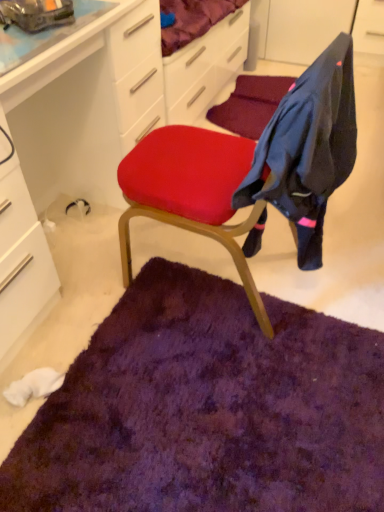
What do you see at coordinates (252, 170) in the screenshot? I see `matte red cushion at center` at bounding box center [252, 170].

Describe the element at coordinates (308, 148) in the screenshot. I see `dark blue fabric at upper right` at that location.

Where is `matte red cushion at center`? The height and width of the screenshot is (512, 384). matte red cushion at center is located at coordinates (252, 170).

From the image's perspective, does dark blue fabric at upper right appear lower than matte red cushion at center?

Yes.

Is dark blue fabric at upper right oriented towards matte red cushion at center?

Yes, dark blue fabric at upper right is turned towards matte red cushion at center.

From a real-world perspective, is dark blue fabric at upper right positioned over matte red cushion at center based on gravity?

Yes, from a real-world perspective, dark blue fabric at upper right is above matte red cushion at center.

Identify the location of clothing on the right of matte red cushion at center. (308, 148).

Would you say purple shaggy rug at center is to the left or to the right of white glossy computer desk at upper left in the picture?

In the image, purple shaggy rug at center appears on the right side of white glossy computer desk at upper left.

Can you confirm if purple shaggy rug at center is smaller than white glossy computer desk at upper left?

Yes.

Is purple shaggy rug at center oriented towards white glossy computer desk at upper left?

No.

In the scene shown: Is white glossy computer desk at upper left located within purple shaggy rug at center?

That's incorrect, white glossy computer desk at upper left is not inside purple shaggy rug at center.

In the image, is purple shaggy rug at center on the left side or the right side of matte red cushion at center?

In the image, purple shaggy rug at center appears on the left side of matte red cushion at center.

In the scene shown: Can you confirm if purple shaggy rug at center is shorter than matte red cushion at center?

Correct, purple shaggy rug at center is not as tall as matte red cushion at center.

Based on the photo, is purple shaggy rug at center not close to matte red cushion at center?

No, there isn't a large distance between purple shaggy rug at center and matte red cushion at center.

Between point (209, 309) and point (243, 162), which one is positioned behind?

The point (209, 309) is more distant.

Is white glossy computer desk at upper left at the left side of matte red cushion at center?

Yes, white glossy computer desk at upper left is to the left of matte red cushion at center.

Could you tell me if white glossy computer desk at upper left is turned towards matte red cushion at center?

Yes, white glossy computer desk at upper left is facing matte red cushion at center.

From a real-world perspective, between white glossy computer desk at upper left and matte red cushion at center, who is vertically higher?

From a 3D spatial view, matte red cushion at center is above.

Between matte red cushion at center and dark blue fabric at upper right, which one has smaller width?

dark blue fabric at upper right is thinner.

Are matte red cushion at center and dark blue fabric at upper right beside each other?

Yes, matte red cushion at center is with dark blue fabric at upper right.

Considering the sizes of matte red cushion at center and dark blue fabric at upper right in the image, is matte red cushion at center bigger or smaller than dark blue fabric at upper right?

matte red cushion at center is bigger than dark blue fabric at upper right.

Does purple shaggy rug at center have a lesser height compared to dark blue fabric at upper right?

Correct, purple shaggy rug at center is not as tall as dark blue fabric at upper right.

You are a GUI agent. You are given a task and a screenshot of the screen. Output one action in this format:
    pyautogui.click(x=<x>, y=<y>)
    Task: Click on the mat that is behind the dark blue fabric at upper right
    Image resolution: width=384 pixels, height=512 pixels.
    Given the screenshot: What is the action you would take?
    pyautogui.click(x=207, y=409)

From the image's perspective, which object appears higher, purple shaggy rug at center or dark blue fabric at upper right?

dark blue fabric at upper right.

Could you tell me if dark blue fabric at upper right is facing white glossy computer desk at upper left?

Yes.

Considering the relative positions of dark blue fabric at upper right and white glossy computer desk at upper left in the image provided, is dark blue fabric at upper right to the left of white glossy computer desk at upper left from the viewer's perspective?

No, dark blue fabric at upper right is not to the left of white glossy computer desk at upper left.

Is dark blue fabric at upper right taller or shorter than white glossy computer desk at upper left?

In the image, dark blue fabric at upper right appears to be shorter than white glossy computer desk at upper left.

This screenshot has width=384, height=512. I want to click on chair that appears above the dark blue fabric at upper right (from the image's perspective), so click(252, 170).

This screenshot has height=512, width=384. In order to click on mat to the right of white glossy computer desk at upper left in this screenshot , I will do `click(207, 409)`.

Looking at the image, which one is located further to purple shaggy rug at center, dark blue fabric at upper right or matte red cushion at center?

dark blue fabric at upper right.

Looking at the image, which one is located further to white glossy computer desk at upper left, matte red cushion at center or dark blue fabric at upper right?

The object further to white glossy computer desk at upper left is dark blue fabric at upper right.

Considering their positions, is dark blue fabric at upper right positioned closer to matte red cushion at center than purple shaggy rug at center?

The object closer to matte red cushion at center is dark blue fabric at upper right.

Which object lies nearer to the anchor point matte red cushion at center, purple shaggy rug at center or dark blue fabric at upper right?

The object closer to matte red cushion at center is dark blue fabric at upper right.

Considering their positions, is white glossy computer desk at upper left positioned further to purple shaggy rug at center than dark blue fabric at upper right?

white glossy computer desk at upper left is further to purple shaggy rug at center.

Considering their positions, is matte red cushion at center positioned closer to purple shaggy rug at center than dark blue fabric at upper right?

Based on the image, matte red cushion at center appears to be nearer to purple shaggy rug at center.

Considering their positions, is dark blue fabric at upper right positioned closer to matte red cushion at center than white glossy computer desk at upper left?

dark blue fabric at upper right lies closer to matte red cushion at center than the other object.

In the scene shown: From the image, which object appears to be farther from matte red cushion at center, white glossy computer desk at upper left or dark blue fabric at upper right?

The object further to matte red cushion at center is white glossy computer desk at upper left.

Locate an element on the screen. The height and width of the screenshot is (512, 384). mat between white glossy computer desk at upper left and dark blue fabric at upper right is located at coordinates (207, 409).

Where is `clothing that lies between matte red cushion at center and purple shaggy rug at center from top to bottom`? The width and height of the screenshot is (384, 512). clothing that lies between matte red cushion at center and purple shaggy rug at center from top to bottom is located at coordinates (308, 148).

The image size is (384, 512). Find the location of `chair between white glossy computer desk at upper left and dark blue fabric at upper right from left to right`. chair between white glossy computer desk at upper left and dark blue fabric at upper right from left to right is located at coordinates (252, 170).

I want to click on chair that lies between white glossy computer desk at upper left and purple shaggy rug at center from top to bottom, so click(x=252, y=170).